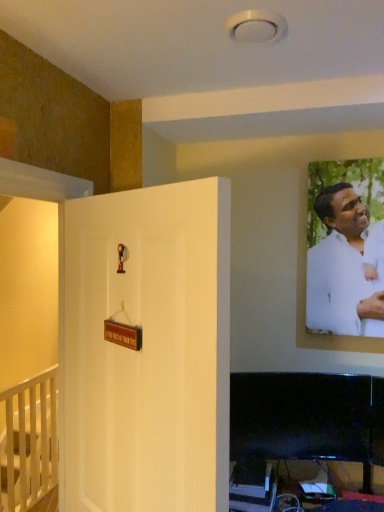
Question: Could you tell me if white matte door at center is turned towards white matte shirt at upper right?

Choices:
 (A) no
 (B) yes

Answer: (A)

Question: Is white matte door at center completely or partially outside of white matte shirt at upper right?

Choices:
 (A) yes
 (B) no

Answer: (A)

Question: Is white matte door at center positioned behind white matte shirt at upper right?

Choices:
 (A) no
 (B) yes

Answer: (A)

Question: Can you confirm if white matte door at center is positioned to the left of white matte shirt at upper right?

Choices:
 (A) yes
 (B) no

Answer: (A)

Question: Is white matte door at center positioned with its back to white matte shirt at upper right?

Choices:
 (A) yes
 (B) no

Answer: (A)

Question: Does point (283, 434) appear closer or farther from the camera than point (132, 249)?

Choices:
 (A) closer
 (B) farther

Answer: (B)

Question: In the image, is black glossy tv at lower right, acting as the 1th furniture starting from the front, on the left side or the right side of white matte door at center?

Choices:
 (A) right
 (B) left

Answer: (A)

Question: Is black glossy tv at lower right, which is the second furniture from bottom to top, taller or shorter than white matte door at center?

Choices:
 (A) tall
 (B) short

Answer: (B)

Question: From a real-world perspective, is black glossy tv at lower right, acting as the 1th furniture starting from the front, above or below white matte door at center?

Choices:
 (A) below
 (B) above

Answer: (A)

Question: Is white matte shirt at upper right in front of or behind white matte door at center in the image?

Choices:
 (A) front
 (B) behind

Answer: (B)

Question: From a real-world perspective, is white matte shirt at upper right physically located above or below white matte door at center?

Choices:
 (A) above
 (B) below

Answer: (A)

Question: Is white matte shirt at upper right wider or thinner than white matte door at center?

Choices:
 (A) wide
 (B) thin

Answer: (B)

Question: Considering the positions of point (339, 203) and point (135, 192), is point (339, 203) closer or farther from the camera than point (135, 192)?

Choices:
 (A) farther
 (B) closer

Answer: (A)

Question: From a real-world perspective, relative to white matte shirt at upper right, is white wooden railing at lower left, which ranks as the first furniture in left-to-right order, vertically above or below?

Choices:
 (A) below
 (B) above

Answer: (A)

Question: Visually, is white wooden railing at lower left, which ranks as the first furniture in left-to-right order, positioned to the left or to the right of white matte shirt at upper right?

Choices:
 (A) left
 (B) right

Answer: (A)